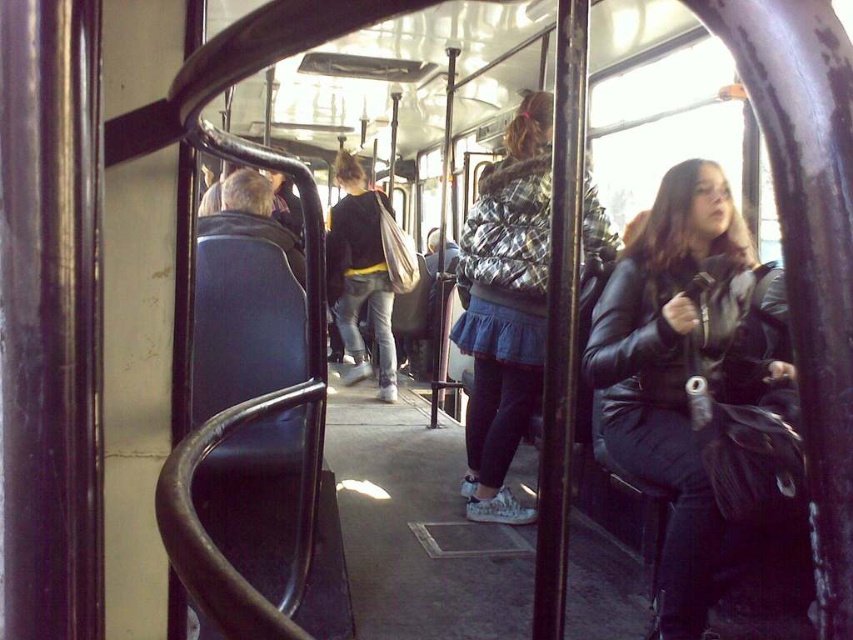
Can you confirm if plaid fur coat at center is smaller than black leather jacket at center?

Actually, plaid fur coat at center might be larger than black leather jacket at center.

Does plaid fur coat at center appear on the right side of black leather jacket at center?

Correct, you'll find plaid fur coat at center to the right of black leather jacket at center.

Is point (479, 316) more distant than point (334, 294)?

No, it is not.

Locate an element on the screen. plaid fur coat at center is located at coordinates (505, 307).

Is leather jacket at right bigger than black leather jacket at center?

Indeed, leather jacket at right has a larger size compared to black leather jacket at center.

Where is `leather jacket at right`? leather jacket at right is located at coordinates (697, 387).

Image resolution: width=853 pixels, height=640 pixels. Describe the element at coordinates (697, 387) in the screenshot. I see `leather jacket at right` at that location.

Which of these two, leather jacket at right or plaid fur coat at center, stands taller?

With more height is plaid fur coat at center.

This screenshot has height=640, width=853. What are the coordinates of `leather jacket at right` in the screenshot? It's located at (697, 387).